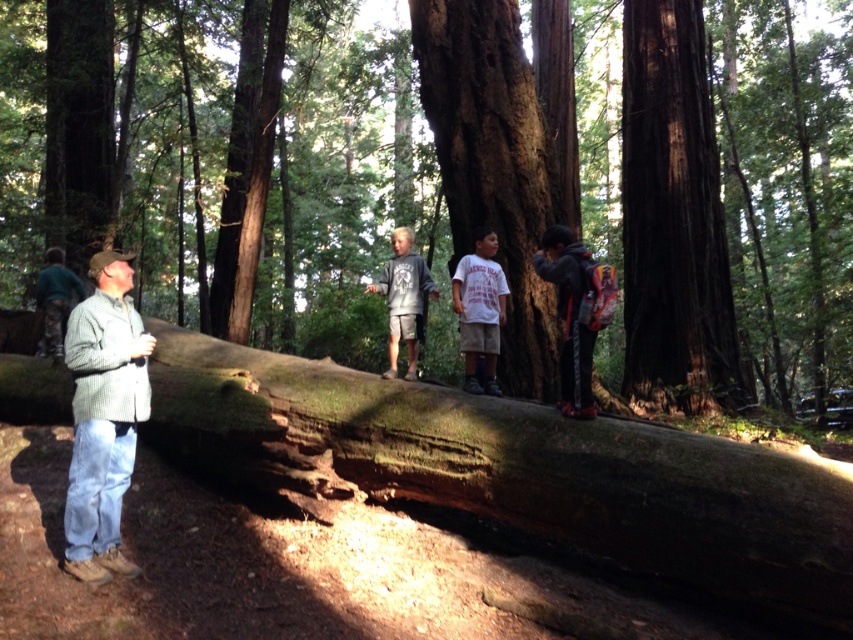
You are a hiker who wants to cross over the smooth brown log at center without stepping on the white cotton shirt at center. How can you do this?

The smooth brown log at center is above the white cotton shirt at center, so you can step onto the smooth brown log at center and walk across it without touching the white cotton shirt at center.

You are a hiker who wants to throw a small rock from the smooth brown log at center to the gray cotton hoodie at center. Given that the rock can travel 12 meters, will it reach the target?

The distance between the smooth brown log at center and the gray cotton hoodie at center is 13.25 meters, which is farther than the rock can travel 12 meters. Therefore, the rock will not reach the target.